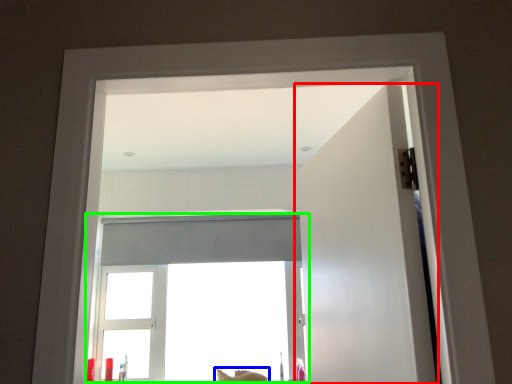
Question: Which object is positioned farthest from door (highlighted by a red box)? Select from animal (highlighted by a blue box) and window (highlighted by a green box).

Choices:
 (A) animal
 (B) window

Answer: (A)